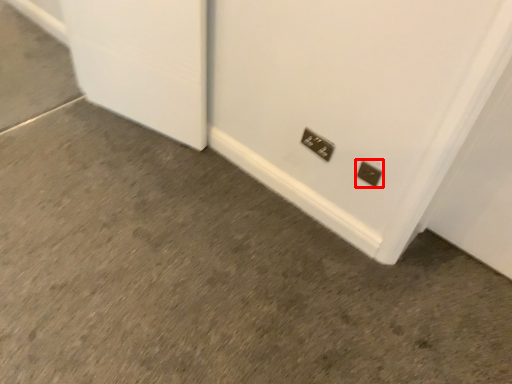
Question: From the image's perspective, where is power plugs and sockets (annotated by the red box) located in relation to power plugs and sockets in the image?

Choices:
 (A) below
 (B) above

Answer: (A)